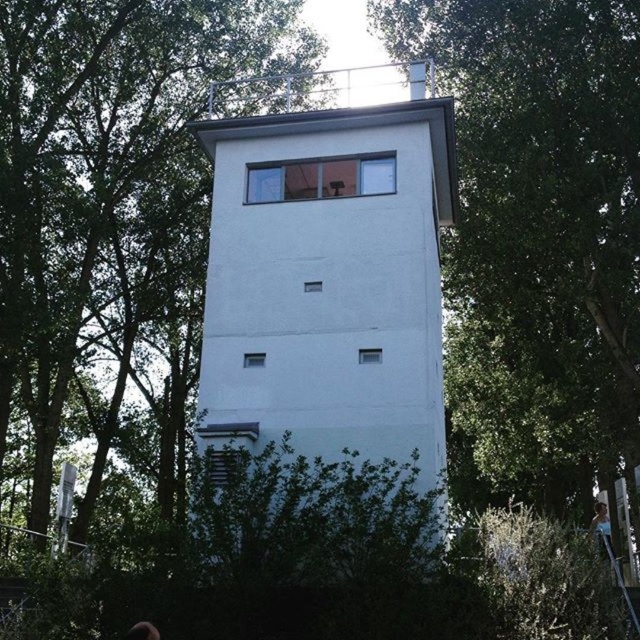
Question: Among these objects, which one is nearest to the camera?

Choices:
 (A) green leafy tree at center
 (B) metallic silver ladder at lower right

Answer: (B)

Question: Is green leafy tree at center to the right of light blue shirt at center from the viewer's perspective?

Choices:
 (A) yes
 (B) no

Answer: (B)

Question: Does white smooth tower at center appear under metallic silver ladder at lower right?

Choices:
 (A) yes
 (B) no

Answer: (B)

Question: Which point is farther from the camera taking this photo?

Choices:
 (A) (252, 49)
 (B) (342, 460)
 (C) (634, 616)

Answer: (A)

Question: Is metallic silver ladder at lower right behind light blue shirt at center?

Choices:
 (A) yes
 (B) no

Answer: (B)

Question: Which point is closer to the camera taking this photo?

Choices:
 (A) (460, 42)
 (B) (134, 632)

Answer: (B)